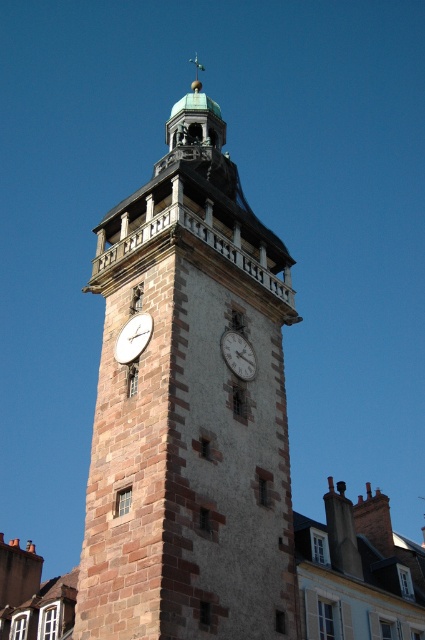
You are standing in front of the clock tower and want to know the exact location of the matte brown clock at center. Can you tell me its coordinates?

The matte brown clock at center is located at coordinates point (133, 337).

You are an architect designing a new clock tower. You have two options for the clock face material and color scheme. The first option is a matte brown clock at center, and the second is a matte stone clock at center. According to the scene description, which clock face has a larger width?

The matte brown clock at center has a larger width than the matte stone clock at center.